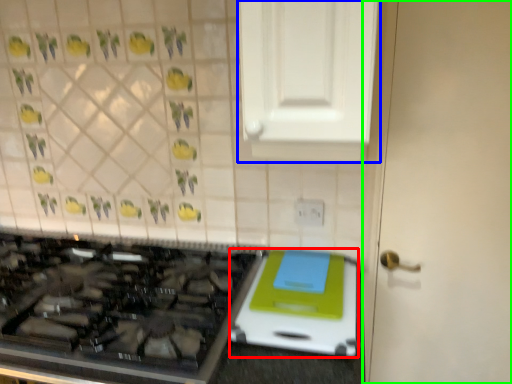
Question: Which object is positioned farthest from appliance (highlighted by a red box)? Select from cabinetry (highlighted by a blue box) and door (highlighted by a green box).

Choices:
 (A) cabinetry
 (B) door

Answer: (A)